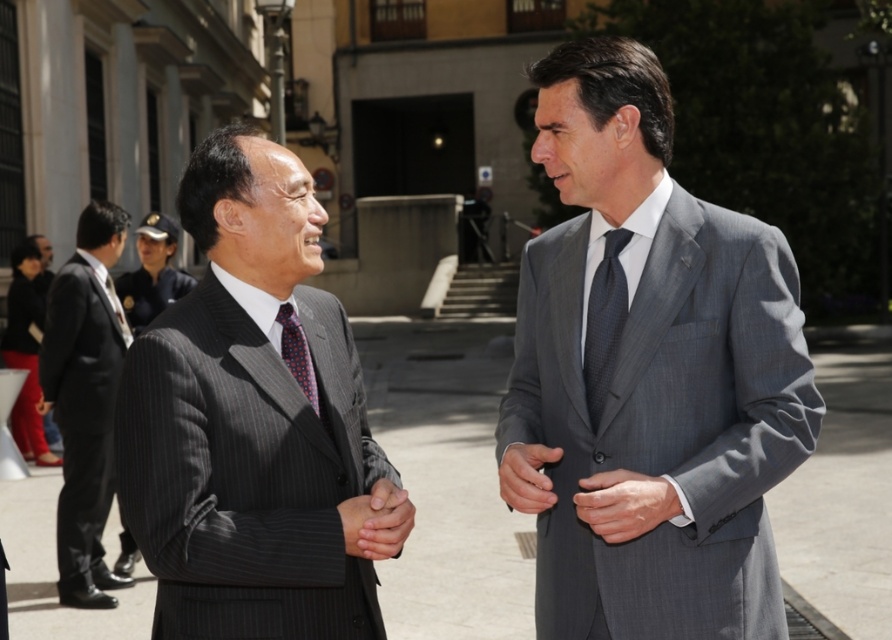
You are a photographer standing at the origin point of the coordinate system. You want to capture a photo of the dark gray pinstripe suit at center. Given that the point marking its location is at coordinate point (253, 422), can you determine if the dark gray pinstripe suit at center is positioned to the right or left of the center point of the image?

The point (253, 422) marks the location of the dark gray pinstripe suit at center. Since the x coordinate is 0.662, which is greater than 0.5, the dark gray pinstripe suit at center is positioned to the right of the center point of the image.

You are standing at the origin point of the coordinate system in the image. You want to approach the black pinstripe suit at left. What are the coordinates you need to move to in order to reach it?

The coordinates to reach the black pinstripe suit at left are at point [85,400].

You are a photographer setting up for a formal event. You need to ensure that the black pinstripe suit at left and the polka dot silk tie at left are both visible in the frame. Given their sizes, which one might require more careful framing to ensure it doesn not get cropped?

The polka dot silk tie at left is smaller than the black pinstripe suit at left, so it might require more careful framing to ensure it doesn not get cropped.